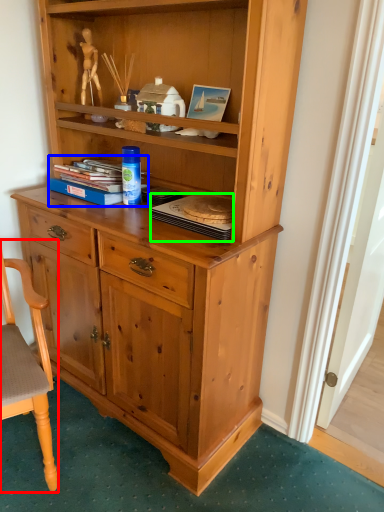
Question: Which object is positioned closest to chair (highlighted by a red box)? Select from book (highlighted by a blue box) and book (highlighted by a green box).

Choices:
 (A) book
 (B) book

Answer: (A)